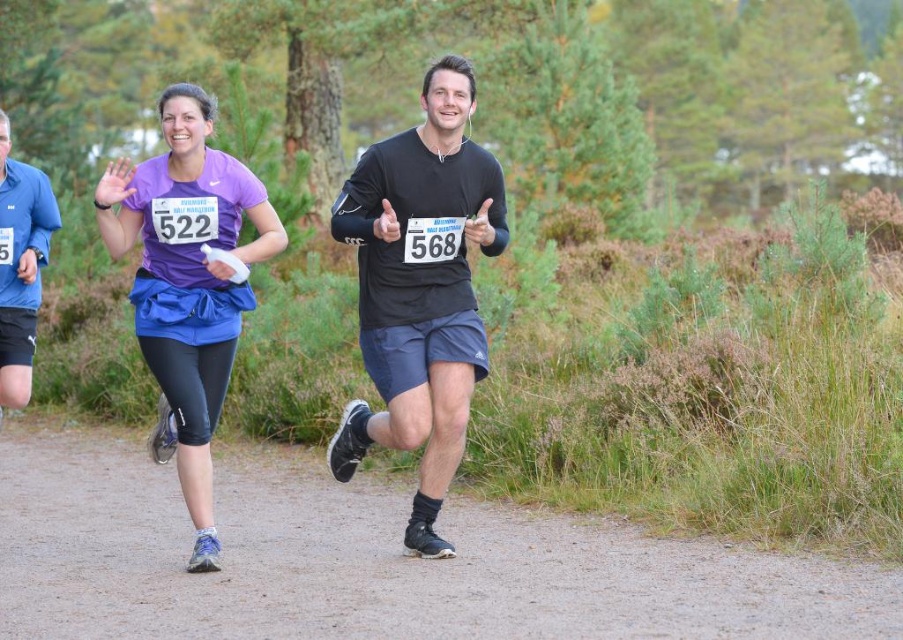
You are a photographer positioned at the starting line of the race. You want to take a photo that includes both the dirt trail at center and the purple matte shirt at center. Based on their positions, which object should you pan your camera towards first to ensure both are in frame?

You should pan your camera towards the purple matte shirt at center first because the dirt trail at center is to the right of it, so capturing the shirt first allows the trail to be included to its right in the frame.